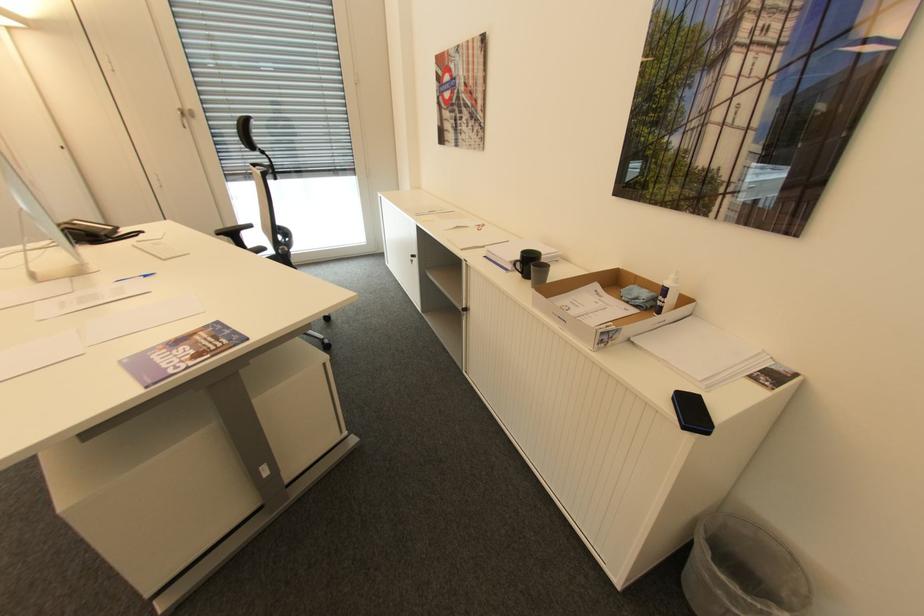
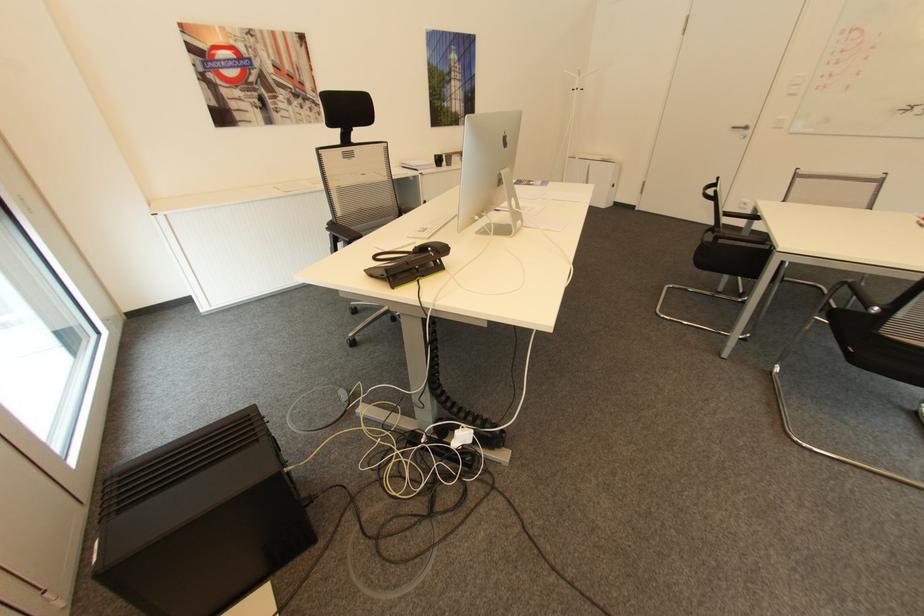
Where in the second image is the point corresponding to [529,252] from the first image?

(441, 155)